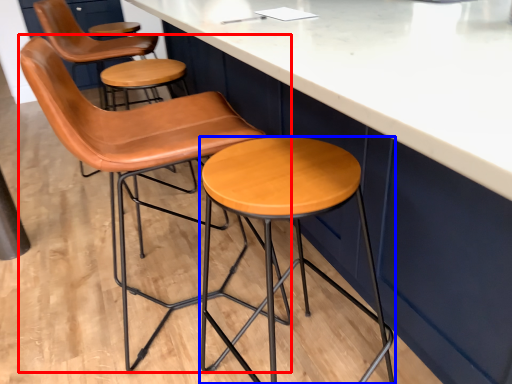
Question: Which object is closer to the camera taking this photo, chair (highlighted by a red box) or stool (highlighted by a blue box)?

Choices:
 (A) chair
 (B) stool

Answer: (B)